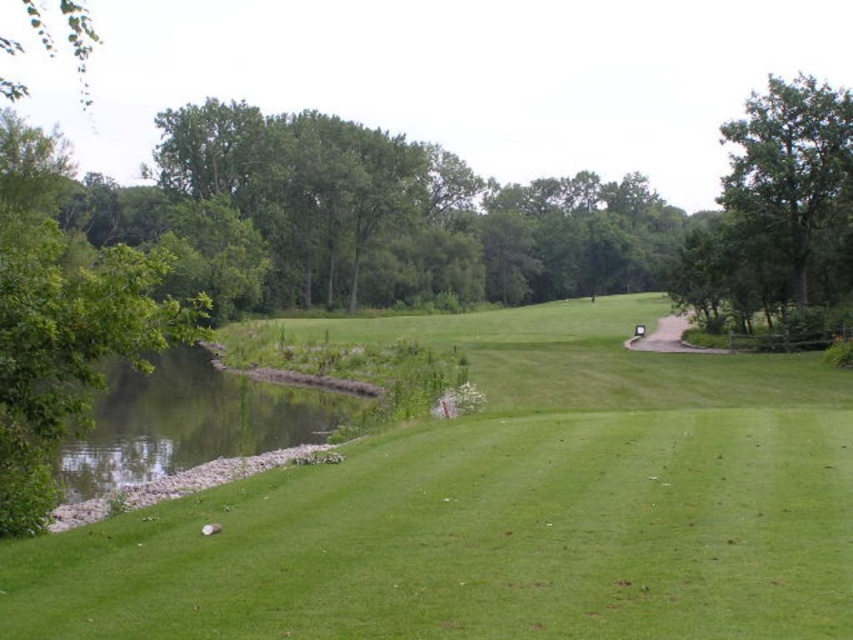
You are a golfer standing at the tee, and you want to hit a golf ball to the green area. The green is located behind the green leafy tree at upper right. If the tree is 43.31 meters away, and your longest drive is 250 yards, will you be able to reach the green in one shot?

The green leafy tree at upper right is 43.31 meters from the viewer. Since 43.31 meters is approximately 47.36 yards and your longest drive is 250 yards, you will easily reach the green in one shot.

You are a golfer standing at the tee and want to hit your ball to the green. There are two points marked on the course. The first point is at coordinate point(740, 577) and the second point is at coordinate point(817, 216). According to the scene description, which point is closer to you as you stand at the tee?

Point(740, 577) is in front of point(817, 216), so the point closer to you is point(740, 577).

You are a golfer standing on the fairway and looking towards the green. You notice two green leafy trees in the background. Which tree is positioned lower in the image, the green leafy tree at upper right or the green leafy tree at upper left?

The green leafy tree at upper right is positioned lower in the image than the green leafy tree at upper left.